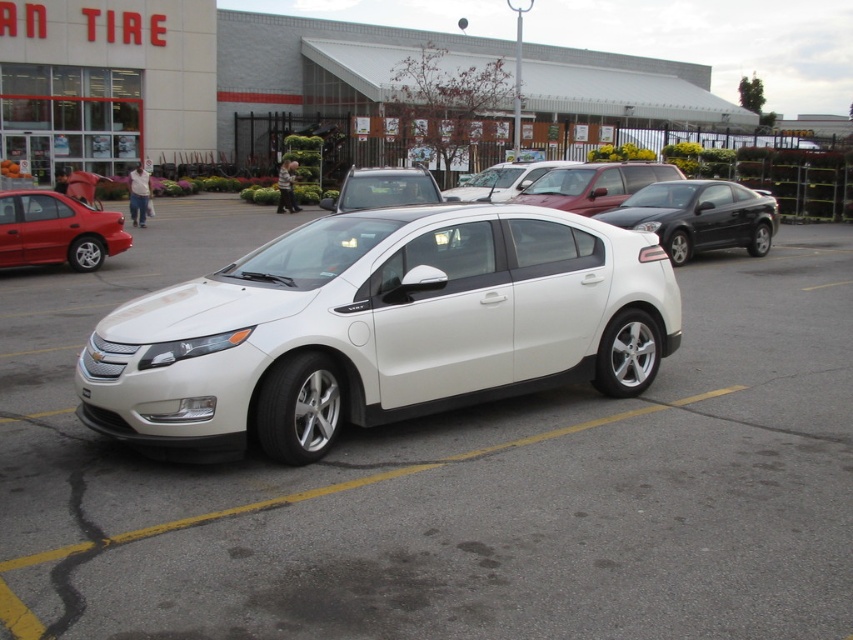
Does point (509, 616) come closer to viewer compared to point (469, 198)?

Yes.

Describe the element at coordinates (451, 481) in the screenshot. The image size is (853, 640). I see `white metallic car at center` at that location.

Is point (103, 284) closer to viewer compared to point (492, 170)?

Yes, point (103, 284) is closer to viewer.

The width and height of the screenshot is (853, 640). I want to click on white metallic car at center, so click(x=451, y=481).

Which of these two, glossy black sedan at center or white matte sedan at center, stands shorter?

glossy black sedan at center is shorter.

The width and height of the screenshot is (853, 640). In order to click on glossy black sedan at center in this screenshot , I will do `click(699, 216)`.

The image size is (853, 640). I want to click on glossy black sedan at center, so click(x=699, y=216).

Can you confirm if white glossy sedan at center is bigger than glossy black sedan at center?

Actually, white glossy sedan at center might be smaller than glossy black sedan at center.

Does point (84, 385) come closer to viewer compared to point (686, 230)?

That is True.

Who is more forward, (x=537, y=209) or (x=741, y=204)?

Point (x=537, y=209) is in front.

This screenshot has height=640, width=853. Identify the location of white glossy sedan at center. (380, 328).